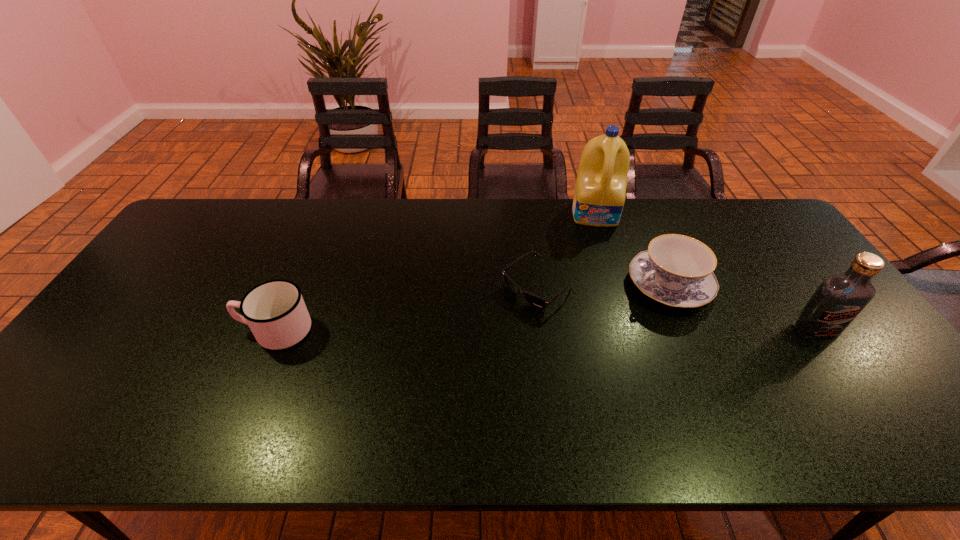
What are the coordinates of `blank space located on the side of the mug with the handle` in the screenshot? It's located at (109, 330).

The image size is (960, 540). Identify the location of vacant space situated 0.070m on the front-facing side of the vodka. (838, 363).

Find the location of a particular element. This screenshot has height=540, width=960. free space located 0.130m with the handle on the side of the chinaware is located at coordinates click(x=607, y=320).

At what (x,y) coordinates should I click in order to perform the action: click on vacant area situated with the handle on the side of the chinaware. Please return your answer as a coordinate pair (x, y). Looking at the image, I should click on (617, 314).

I want to click on free spot located 0.180m with the handle on the side of the chinaware, so click(x=593, y=328).

The height and width of the screenshot is (540, 960). Identify the location of blank space located 0.160m on the label of the tallest object. (600, 259).

Find the location of a particular element. This screenshot has height=540, width=960. vacant space located on the label of the tallest object is located at coordinates (606, 306).

Image resolution: width=960 pixels, height=540 pixels. In order to click on vacant point located on the label of the tallest object in this screenshot , I will do `click(605, 298)`.

This screenshot has width=960, height=540. What are the coordinates of `vacant space located 0.090m on the front-facing side of the fourth object from right to left` in the screenshot? It's located at (492, 325).

Where is `vacant space located on the front-facing side of the fourth object from right to left`? The width and height of the screenshot is (960, 540). vacant space located on the front-facing side of the fourth object from right to left is located at coordinates (468, 343).